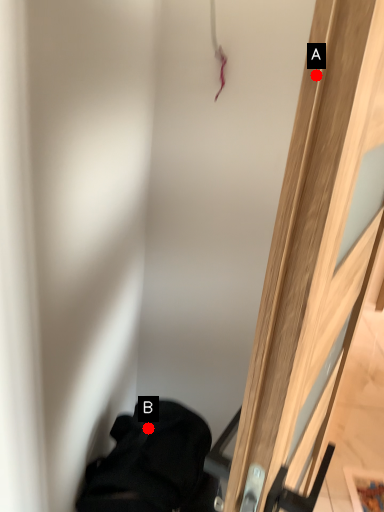
Question: Two points are circled on the image, labeled by A and B beside each circle. Which point appears farthest from the camera in this image?

Choices:
 (A) A is further
 (B) B is further

Answer: (B)